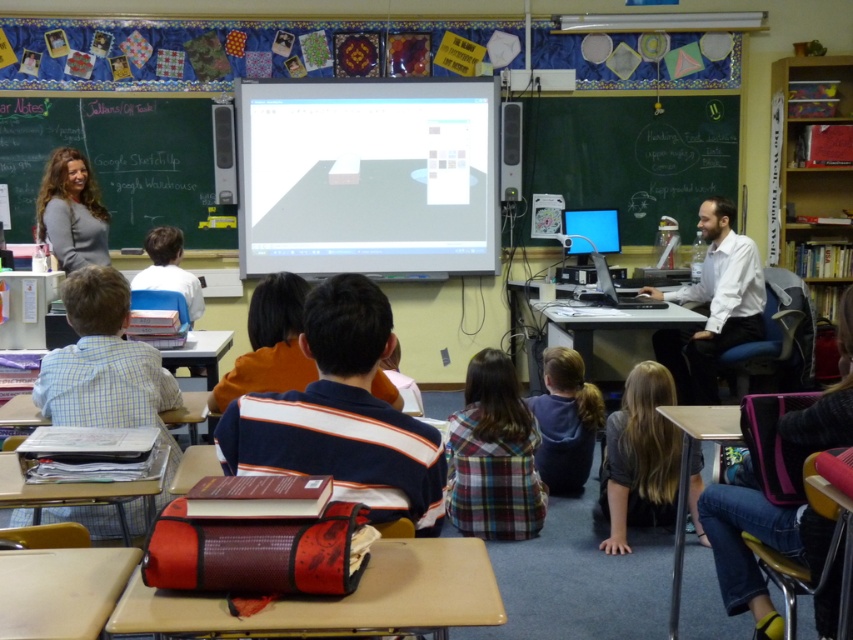
Question: Based on their relative distances, which object is farther from the green chalkboard at upper left?

Choices:
 (A) dark gray shirt at lower center
 (B) white shirt at right

Answer: (A)

Question: Does dark gray shirt at lower center appear on the left side of white shirt at right?

Choices:
 (A) no
 (B) yes

Answer: (B)

Question: Can you confirm if green chalkboard at upper left is positioned above white shirt at right?

Choices:
 (A) no
 (B) yes

Answer: (B)

Question: Can you confirm if green chalkboard at upper left is positioned above plaid fabric shirt at center?

Choices:
 (A) no
 (B) yes

Answer: (B)

Question: Which object is positioned farthest from the dark gray shirt at lower center?

Choices:
 (A) white shirt at right
 (B) green chalkboard at upper left
 (C) plaid fabric shirt at center

Answer: (B)

Question: Based on their relative distances, which object is farther from the white shirt at right?

Choices:
 (A) dark gray shirt at lower center
 (B) green chalkboard at upper left
 (C) plaid fabric shirt at center

Answer: (B)